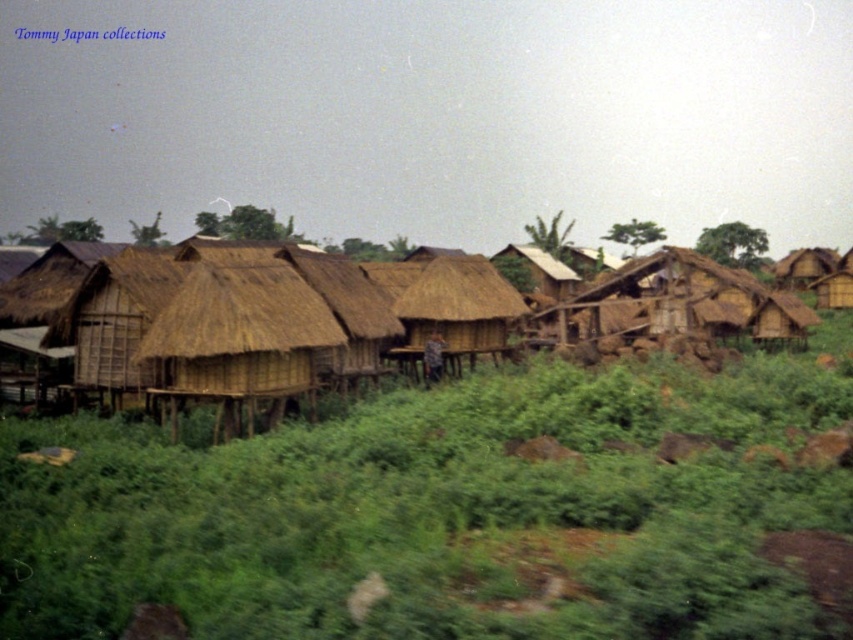
Is brown thatch-roofed huts at center closer to camera compared to brown thatch hut at right?

Yes, brown thatch-roofed huts at center is closer to the viewer.

This screenshot has height=640, width=853. What do you see at coordinates (352, 314) in the screenshot?
I see `brown thatch-roofed huts at center` at bounding box center [352, 314].

Locate an element on the screen. This screenshot has width=853, height=640. brown thatch-roofed huts at center is located at coordinates (352, 314).

Can you confirm if brown thatch-roofed huts at center is wider than thatched straw hut at center?

Correct, the width of brown thatch-roofed huts at center exceeds that of thatched straw hut at center.

Is brown thatch-roofed huts at center closer to the viewer compared to thatched straw hut at center?

Yes, brown thatch-roofed huts at center is in front of thatched straw hut at center.

Which is in front, point (163, 320) or point (425, 268)?

Point (163, 320) is more forward.

You are a GUI agent. You are given a task and a screenshot of the screen. Output one action in this format:
    pyautogui.click(x=<x>, y=<y>)
    Task: Click on the brown thatch-roofed huts at center
    The width and height of the screenshot is (853, 640).
    Given the screenshot: What is the action you would take?
    pyautogui.click(x=352, y=314)

Is brown thatch hut at center wider than thatched straw hut at center?

Incorrect, brown thatch hut at center's width does not surpass thatched straw hut at center's.

Can you confirm if brown thatch hut at center is positioned below thatched straw hut at center?

Yes, brown thatch hut at center is below thatched straw hut at center.

Identify the location of brown thatch hut at center. (238, 340).